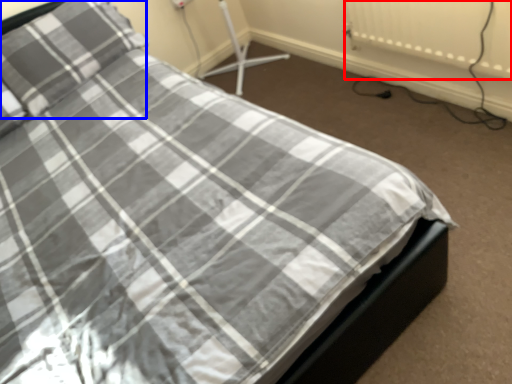
Question: Among these objects, which one is nearest to the camera, radiator (highlighted by a red box) or pillow (highlighted by a blue box)?

Choices:
 (A) radiator
 (B) pillow

Answer: (A)